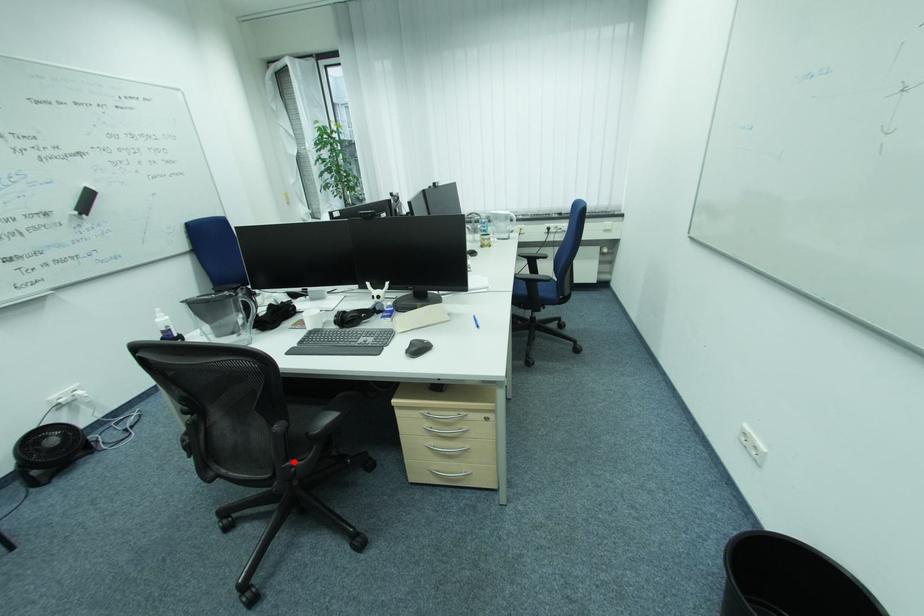
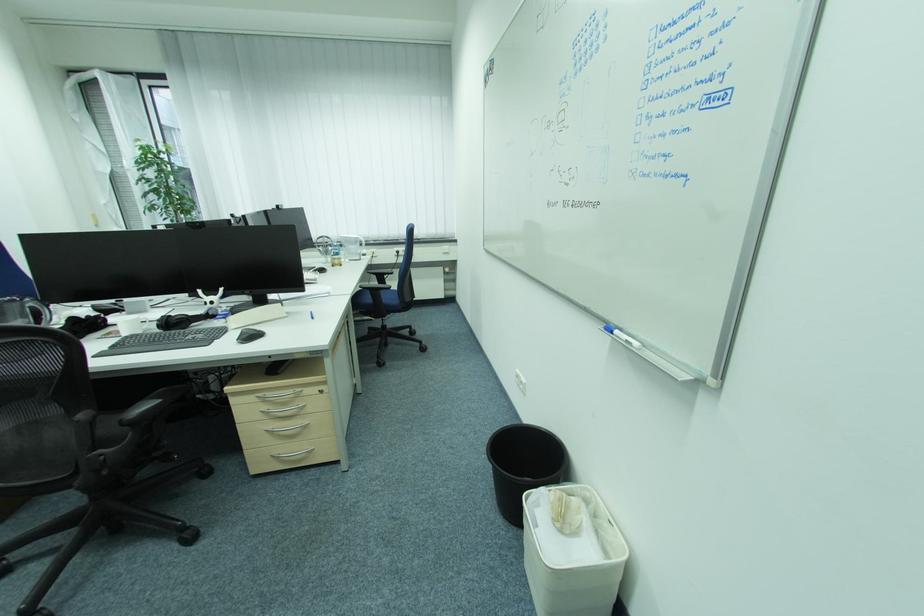
The point at the highlighted location is marked in the first image. Where is the corresponding point in the second image?

(102, 452)